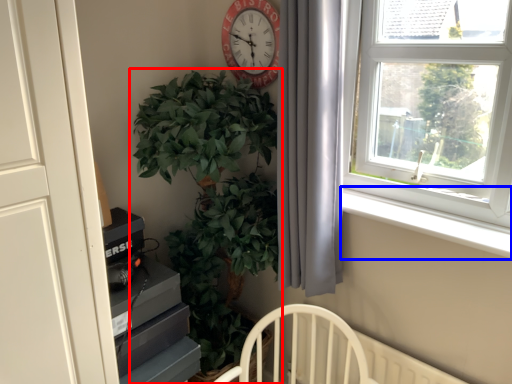
Question: Which point is further to the camera, houseplant (highlighted by a red box) or window sill (highlighted by a blue box)?

Choices:
 (A) houseplant
 (B) window sill

Answer: (B)